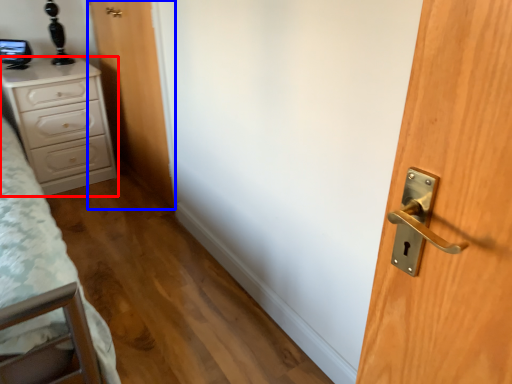
Question: Which object appears closest to the camera in this image, chest of drawers (highlighted by a red box) or door (highlighted by a blue box)?

Choices:
 (A) chest of drawers
 (B) door

Answer: (B)